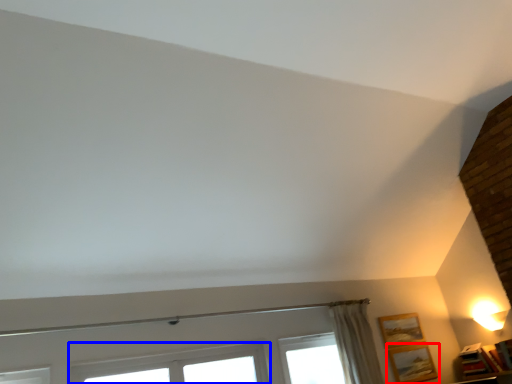
Question: Which point is further to the camera, picture frame (highlighted by a red box) or window (highlighted by a blue box)?

Choices:
 (A) picture frame
 (B) window

Answer: (A)